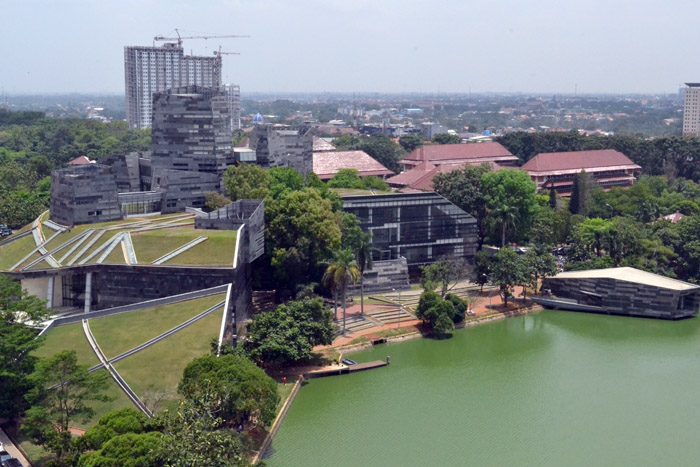
The width and height of the screenshot is (700, 467). What are the coordinates of `stairs` in the screenshot? It's located at (386, 313).